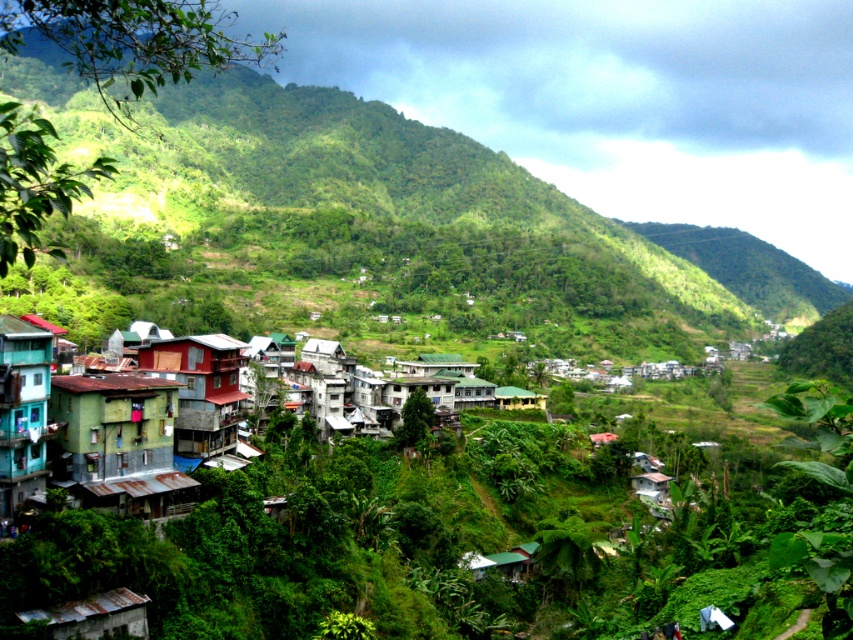
Does rusty metal shacks at lower left appear under green matte building at lower left?

Correct, rusty metal shacks at lower left is located below green matte building at lower left.

Locate an element on the screen. rusty metal shacks at lower left is located at coordinates (94, 428).

Locate an element on the screen. rusty metal shacks at lower left is located at coordinates (94, 428).

Is rusty metal shacks at lower left positioned in front of rustic wood hut at center-left?

Yes, rusty metal shacks at lower left is closer to the viewer.

Does point (125, 444) come closer to viewer compared to point (227, 342)?

Yes, it is in front of point (227, 342).

The width and height of the screenshot is (853, 640). In order to click on rusty metal shacks at lower left in this screenshot , I will do `click(94, 428)`.

Locate an element on the screen. The height and width of the screenshot is (640, 853). green leafy hillside at center is located at coordinates (457, 188).

Between point (451, 156) and point (134, 404), which one is positioned behind?

Positioned behind is point (451, 156).

What are the coordinates of `green leafy hillside at center` in the screenshot? It's located at (457, 188).